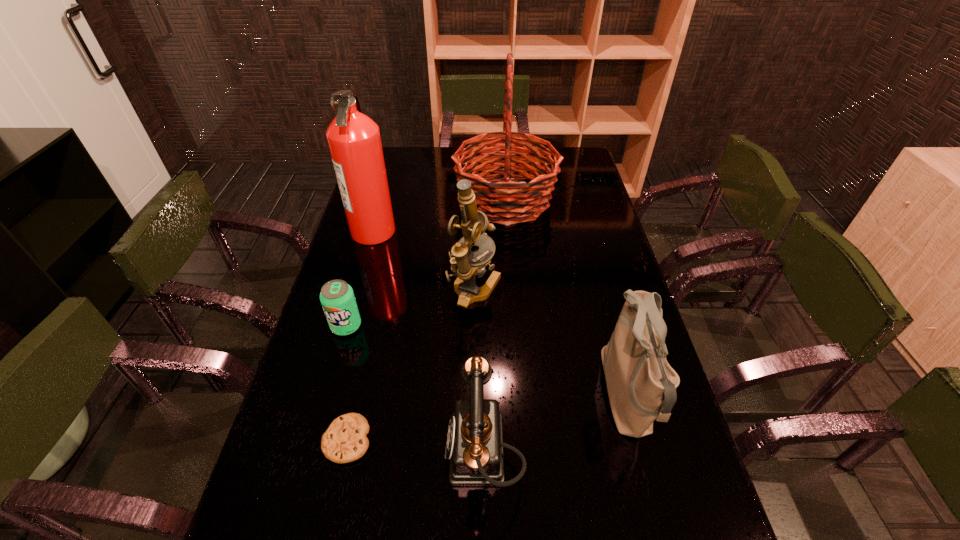
This screenshot has height=540, width=960. I want to click on vacant space at the far right corner of the desktop, so click(x=578, y=163).

At what (x,y) coordinates should I click in order to perform the action: click on free space between the cookie and the basket. Please return your answer as a coordinate pair (x, y). This screenshot has height=540, width=960. Looking at the image, I should click on (426, 320).

Identify the location of vacant space that's between the cookie and the pop soda. This screenshot has width=960, height=540. (347, 383).

Identify the location of empty space between the cookie and the fifth shortest object. (411, 364).

In order to click on empty location between the second shortest object and the shortest object in this screenshot , I will do `click(347, 383)`.

This screenshot has height=540, width=960. In order to click on free spot between the fire extinguisher and the fifth nearest object in this screenshot , I will do `click(423, 260)`.

The width and height of the screenshot is (960, 540). I want to click on free space that is in between the shortest object and the basket, so click(x=426, y=320).

Identify the location of free space between the fifth nearest object and the shortest object. Image resolution: width=960 pixels, height=540 pixels. (411, 364).

At what (x,y) coordinates should I click in order to perform the action: click on the fourth closest object to the cookie. Please return your answer as a coordinate pair (x, y). The width and height of the screenshot is (960, 540). Looking at the image, I should click on (641, 384).

This screenshot has height=540, width=960. In order to click on the fifth closest object to the fourth shortest object in this screenshot , I will do `click(337, 298)`.